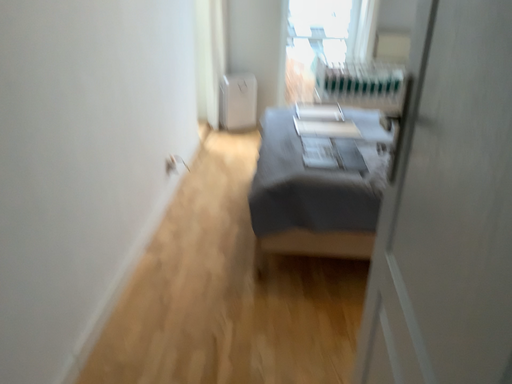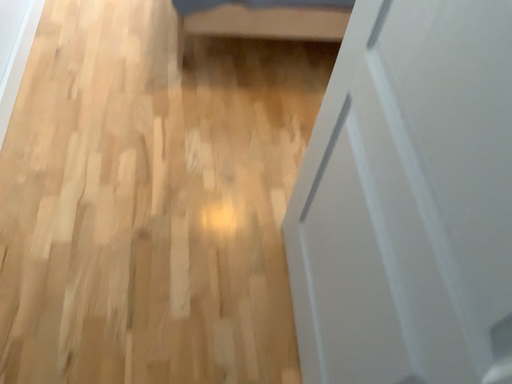
Question: Which way did the camera rotate in the video?

Choices:
 (A) rotated right
 (B) rotated left

Answer: (A)